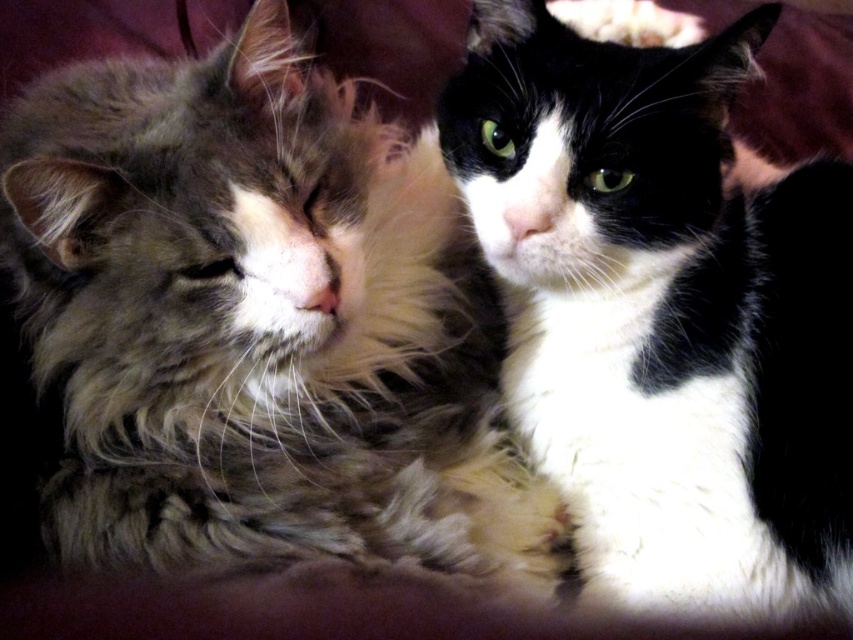
Looking at this image, you are a photographer trying to capture a closeup shot of the black and white fur cat at center. Since the fluffy fur cat at center is blocking part of the view, can you adjust your position to take the photo without moving the cats?

The fluffy fur cat at center is positioned under the black and white fur cat at center, so you can move your camera slightly upward to capture the black and white fur cat at center while avoiding the fluffy fur cat at center.

Consider the image. Based on the coordinates provided in the description, where is the fluffy fur cat at center located in the image?

The fluffy fur cat at center is located at point coordinates of 0.503 on the x axis and 0.302 on the y axis.

You are a photographer who wants to take a photo of both cats in the scene. Since the fluffy fur cat at center is blocking the view of the black and white fur cat at center, how can you adjust your position to ensure both cats are fully visible in the photo?

Move to the side so you can see around the fluffy fur cat at center, which is in front of the black and white fur cat at center, allowing both to be visible.